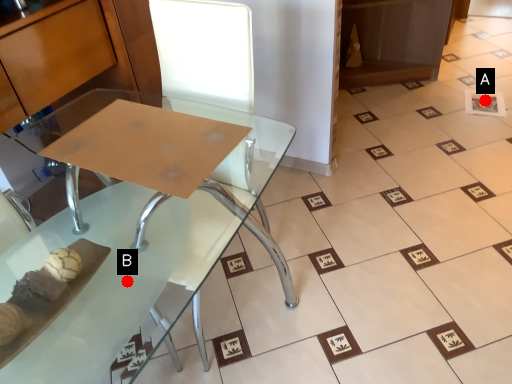
Question: Two points are circled on the image, labeled by A and B beside each circle. Which of the following is the closest to the observer?

Choices:
 (A) A is closer
 (B) B is closer

Answer: (B)